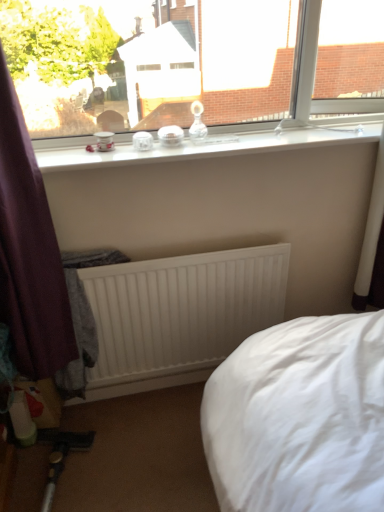
Describe the element at coordinates (192, 63) in the screenshot. This screenshot has width=384, height=512. I see `transparent glass window at upper center` at that location.

Image resolution: width=384 pixels, height=512 pixels. I want to click on clear glass jars at upper center, so click(208, 146).

Based on the photo, in order to face white matte radiator at center, should I rotate leftwards or rightwards?

You should look left and rotate roughly 1.678 degrees.

Identify the location of transparent glass window at upper center. (192, 63).

Considering the relative sizes of clear glass jars at upper center and transparent glass window at upper center in the image provided, is clear glass jars at upper center shorter than transparent glass window at upper center?

Yes, clear glass jars at upper center is shorter than transparent glass window at upper center.

Is clear glass jars at upper center facing towards transparent glass window at upper center?

No, clear glass jars at upper center is not turned towards transparent glass window at upper center.

Looking at their sizes, would you say clear glass jars at upper center is wider or thinner than transparent glass window at upper center?

Considering their sizes, clear glass jars at upper center looks broader than transparent glass window at upper center.

Considering the relative positions of clear glass jars at upper center and transparent glass window at upper center in the image provided, is clear glass jars at upper center to the left or to the right of transparent glass window at upper center?

In the image, clear glass jars at upper center appears on the right side of transparent glass window at upper center.

Are white matte radiator at center and transparent glass window at upper center located far from each other?

They are positioned close to each other.

How different are the orientations of white matte radiator at center and transparent glass window at upper center in degrees?

The facing directions of white matte radiator at center and transparent glass window at upper center are 0.241 degrees apart.

Is point (269, 300) more distant than point (189, 116)?

Yes, point (269, 300) is behind point (189, 116).

Considering the sizes of white matte radiator at center and transparent glass window at upper center in the image, is white matte radiator at center taller or shorter than transparent glass window at upper center?

white matte radiator at center is taller than transparent glass window at upper center.

From a real-world perspective, relative to clear glass jars at upper center, is transparent glass window at upper center vertically above or below?

transparent glass window at upper center is above clear glass jars at upper center.

The width and height of the screenshot is (384, 512). I want to click on window in front of the clear glass jars at upper center, so click(192, 63).

Is clear glass jars at upper center inside transparent glass window at upper center?

No, clear glass jars at upper center is located outside of transparent glass window at upper center.

Is there a large distance between transparent glass window at upper center and clear glass jars at upper center?

transparent glass window at upper center is near clear glass jars at upper center, not far away.

Which of these two, transparent glass window at upper center or white matte radiator at center, is wider?

Wider between the two is transparent glass window at upper center.

From the image's perspective, is transparent glass window at upper center over white matte radiator at center?

Yes, from the image's perspective, transparent glass window at upper center is above white matte radiator at center.

Can you confirm if transparent glass window at upper center is taller than white matte radiator at center?

No, transparent glass window at upper center is not taller than white matte radiator at center.

Is transparent glass window at upper center facing away from white matte radiator at center?

transparent glass window at upper center does not have its back to white matte radiator at center.

From a real-world perspective, which object stands above the other?

From a 3D spatial view, clear glass jars at upper center is above.

Between white matte radiator at center and clear glass jars at upper center, which one has less height?

Standing shorter between the two is clear glass jars at upper center.

At what (x,y) coordinates should I click in order to perform the action: click on window sill in front of the white matte radiator at center. Please return your answer as a coordinate pair (x, y). This screenshot has width=384, height=512. Looking at the image, I should click on point(208,146).

Between clear glass jars at upper center and white matte radiator at center, which one is positioned behind?

Positioned behind is white matte radiator at center.

Based on the photo, is clear glass jars at upper center placed right next to white matte radiator at center?

clear glass jars at upper center is not next to white matte radiator at center, and they're not touching.

From the image's perspective, which object appears higher, clear glass jars at upper center or white matte radiator at center?

From the image's view, clear glass jars at upper center is above.

What are the coordinates of `window sill below the transparent glass window at upper center (from the image's perspective)` in the screenshot? It's located at (208, 146).

Locate an element on the screen. The image size is (384, 512). window on the right of the white matte radiator at center is located at coordinates (192, 63).

When comparing their distances from clear glass jars at upper center, does transparent glass window at upper center or white matte radiator at center seem closer?

The object closer to clear glass jars at upper center is transparent glass window at upper center.

Which object lies further to the anchor point transparent glass window at upper center, white matte radiator at center or clear glass jars at upper center?

white matte radiator at center lies further to transparent glass window at upper center than the other object.

When comparing their distances from white matte radiator at center, does clear glass jars at upper center or transparent glass window at upper center seem closer?

clear glass jars at upper center is positioned closer to the anchor white matte radiator at center.

When comparing their distances from transparent glass window at upper center, does clear glass jars at upper center or white matte radiator at center seem further?

white matte radiator at center.

Estimate the real-world distances between objects in this image. Which object is closer to white matte radiator at center, transparent glass window at upper center or clear glass jars at upper center?

clear glass jars at upper center is closer to white matte radiator at center.

Estimate the real-world distances between objects in this image. Which object is closer to clear glass jars at upper center, white matte radiator at center or transparent glass window at upper center?

The object closer to clear glass jars at upper center is transparent glass window at upper center.

This screenshot has width=384, height=512. What are the coordinates of `window sill between transparent glass window at upper center and white matte radiator at center from top to bottom` in the screenshot? It's located at (208, 146).